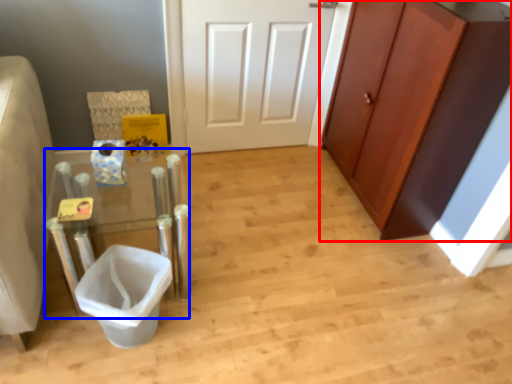
Question: Which object appears farthest to the camera in this image, cabinetry (highlighted by a red box) or vanity (highlighted by a blue box)?

Choices:
 (A) cabinetry
 (B) vanity

Answer: (A)